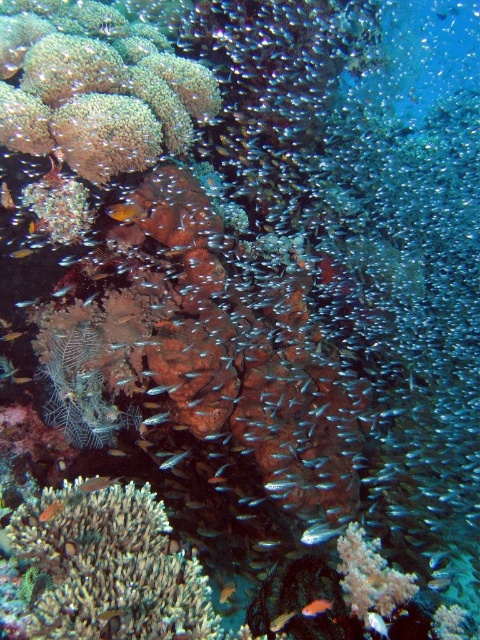
You are a marine biologist observing an underwater coral reef. You notice two fish in the lower center of the scene. Which fish is shorter between the shiny blue fish at lower center and the orange matte fish at lower center?

The shiny blue fish at lower center is shorter than the orange matte fish at lower center.

You are a marine biologist observing an underwater scene. You need to place a 10 inch long measuring tape between the green coral at center and the shiny orange fish at center. Will the measuring tape be long enough to reach both ends?

The distance between the green coral at center and the shiny orange fish at center is 11.36 inches. Since the measuring tape is only 10 inches long, it will not be long enough to fully span the distance between them.

You are a marine biologist observing this underwater scene. You notice the green coral at center and the shiny orange fish at center. Which object is positioned closer to you in this view?

The green coral at center is closer to the viewer than the shiny orange fish at center.